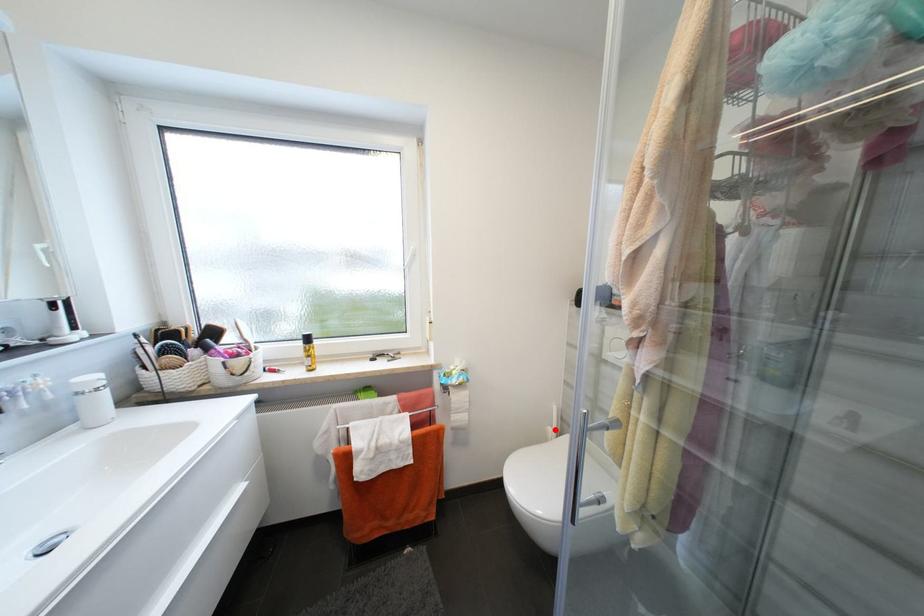
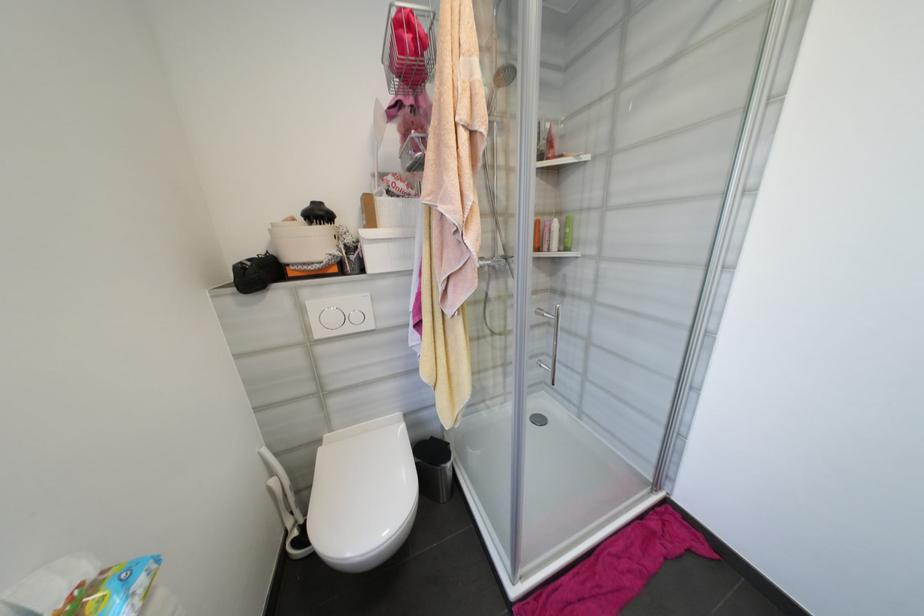
Question: A red point is marked in image1. In image2, is the corresponding 3D point closer to the camera or farther? Reply with the corresponding letter.

Choices:
 (A) The corresponding 3D point is closer.
 (B) The corresponding 3D point is farther.

Answer: (A)